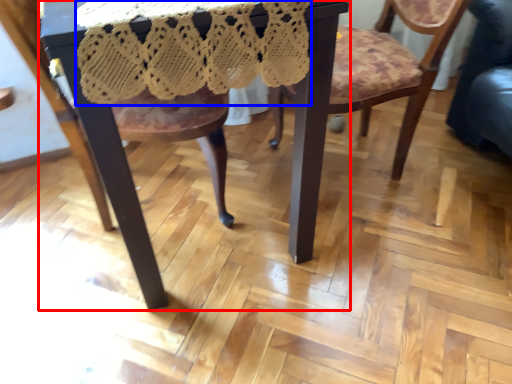
Question: Which object appears closest to the camera in this image, table (highlighted by a red box) or lace dress (highlighted by a blue box)?

Choices:
 (A) table
 (B) lace dress

Answer: (B)